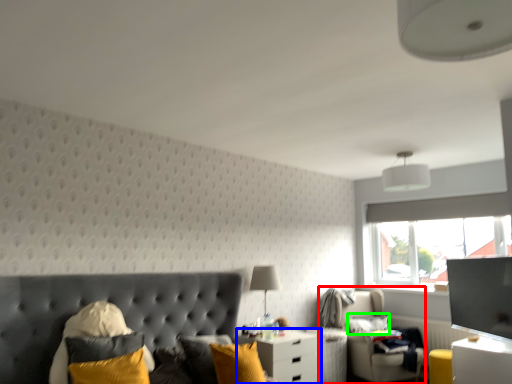
Question: Which object is positioned closest to swivel chair (highlighted by a red box)? Select from nightstand (highlighted by a blue box) and pillow (highlighted by a green box).

Choices:
 (A) nightstand
 (B) pillow

Answer: (B)